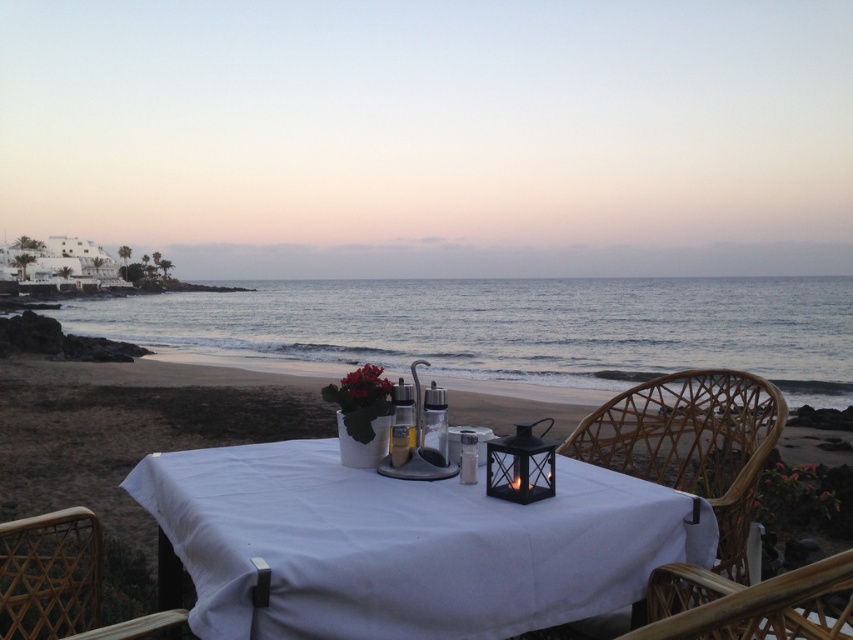
You are a guest at this beachside table and want to sit in the chair closest to the lantern. Which chair should you choose between the woven rattan chair at right and the woven wood chair at lower left?

The woven rattan chair at right is above the woven wood chair at lower left, so the woven rattan chair at right is closer to the lantern placed on the table in the center.